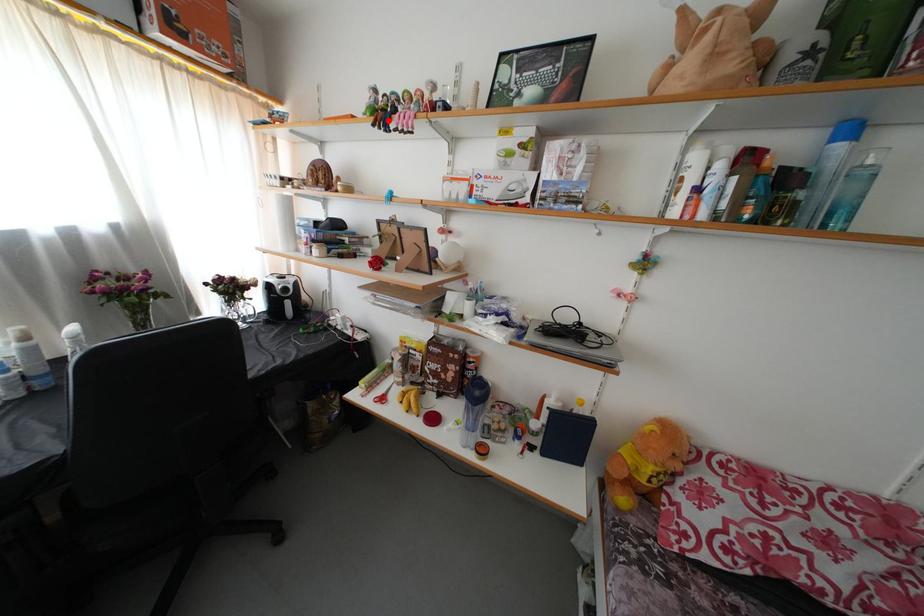
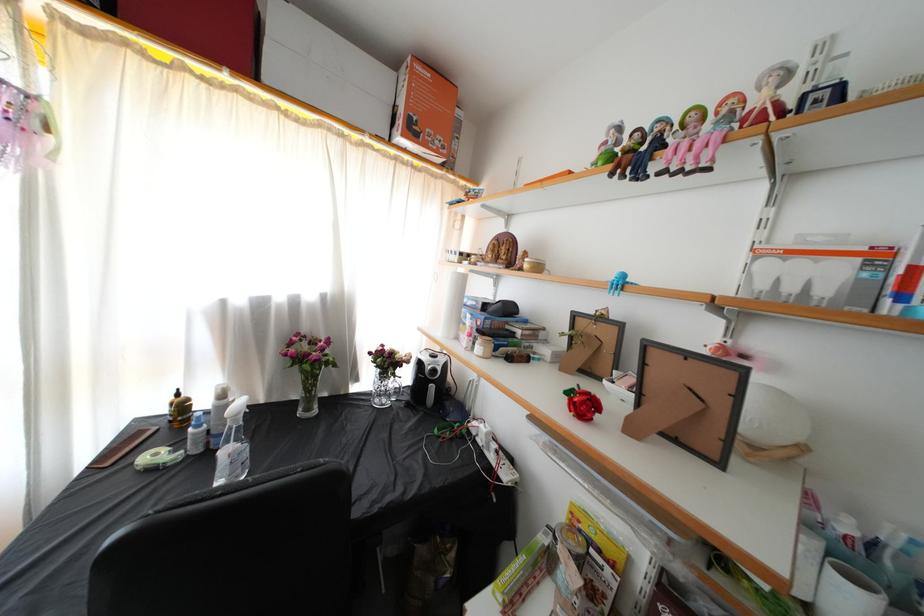
Where in the second image is the point corresponding to the highlighted location from the first image?

(638, 161)